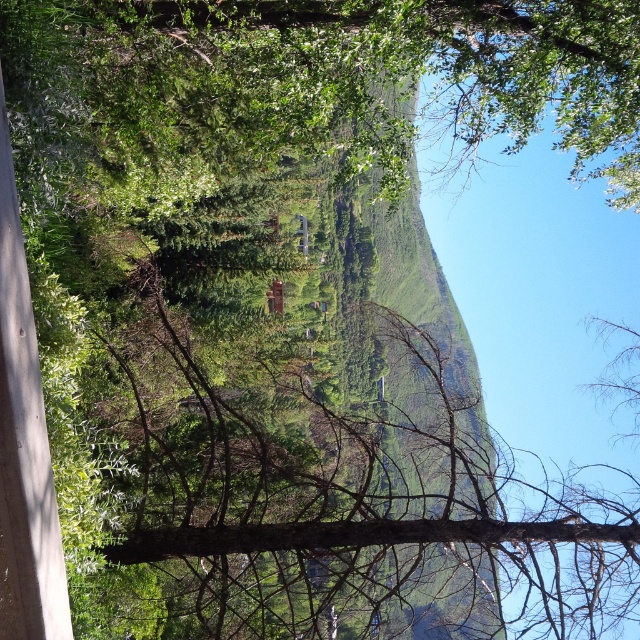
Can you confirm if matte brown house at center is taller than transparent glass window at center?

Incorrect, matte brown house at center's height is not larger of transparent glass window at center's.

Between point (276, 310) and point (305, 218), which one is positioned behind?

Positioned behind is point (305, 218).

Where is `matte brown house at center`? The width and height of the screenshot is (640, 640). matte brown house at center is located at coordinates [x=275, y=296].